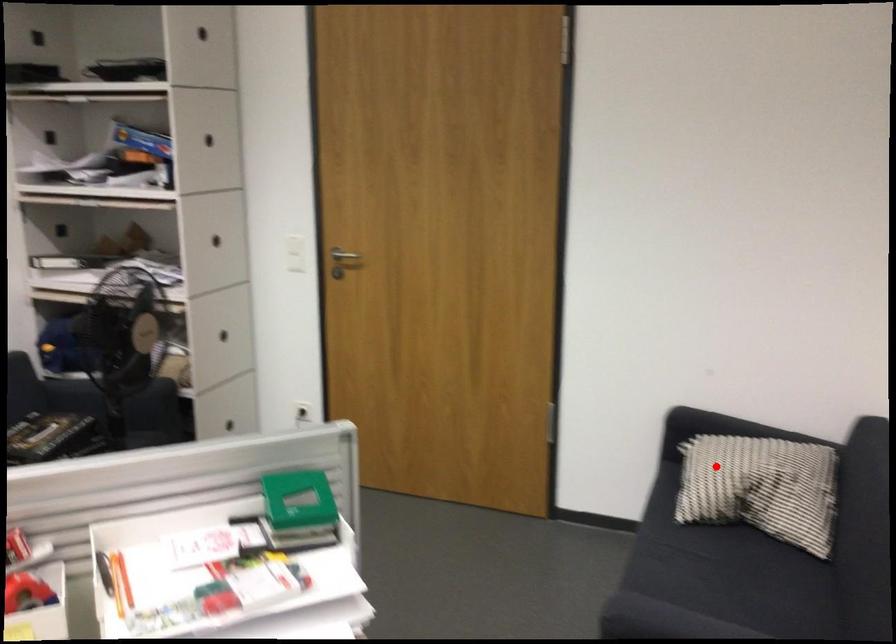
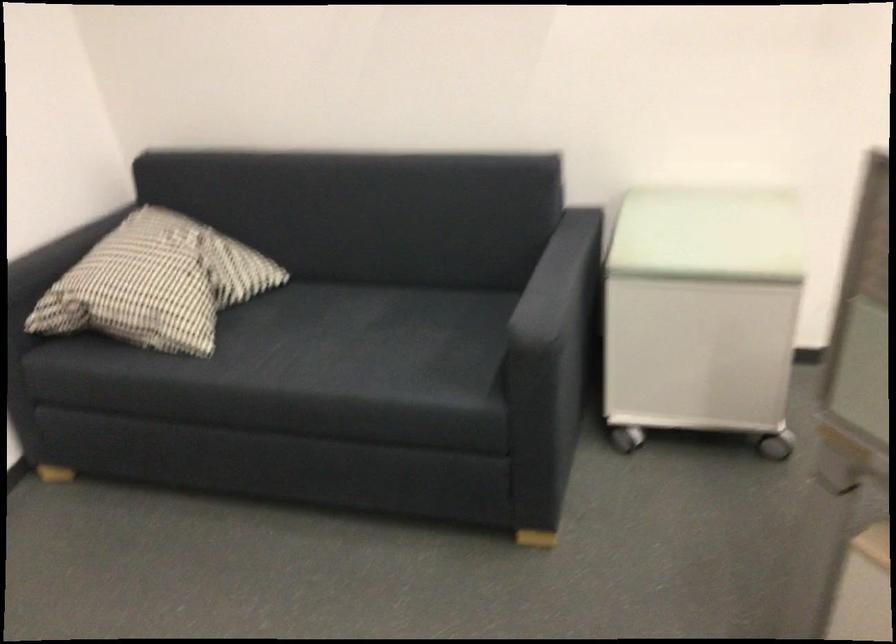
Question: I am providing you with two images of the same scene from different viewpoints. Given a red point in image1, look at the same physical point in image2. Is it:

Choices:
 (A) Closer to the viewpoint
 (B) Farther from the viewpoint

Answer: (A)